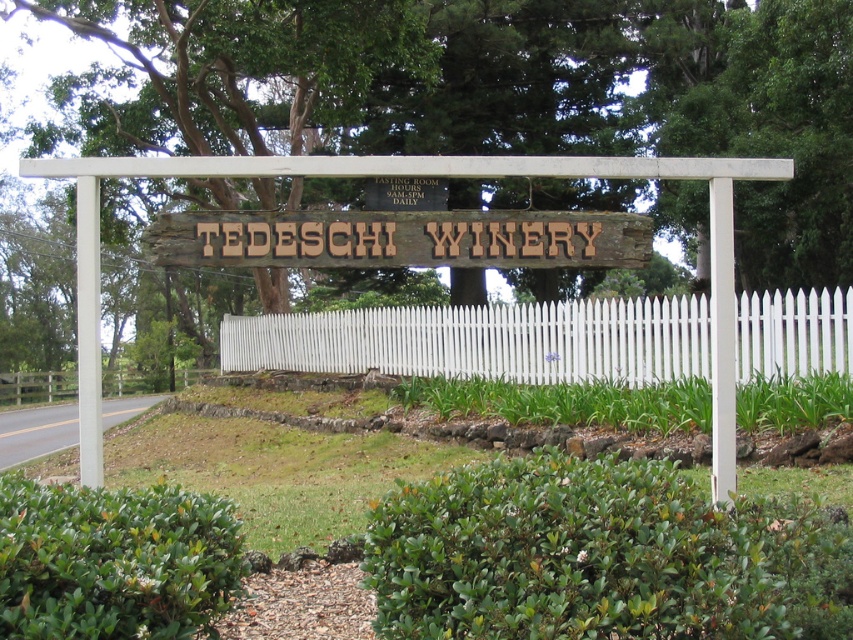
Question: Is green leafy bush at center bigger than white picket fence at center?

Choices:
 (A) no
 (B) yes

Answer: (A)

Question: Which of the following is the closest to the observer?

Choices:
 (A) green leafy bush at center
 (B) green leafy hedge at lower center
 (C) wooden sign at center

Answer: (A)

Question: Which is nearer to the wooden sign at center?

Choices:
 (A) green leafy bush at center
 (B) white picket fence at left

Answer: (A)

Question: Does green leafy bush at center come behind wooden sign at center?

Choices:
 (A) no
 (B) yes

Answer: (A)

Question: Which object is farther from the camera taking this photo?

Choices:
 (A) wooden sign at center
 (B) green leafy hedge at lower center
 (C) white picket fence at left

Answer: (C)

Question: Is green leafy bush at center below green leafy hedge at lower center?

Choices:
 (A) yes
 (B) no

Answer: (A)